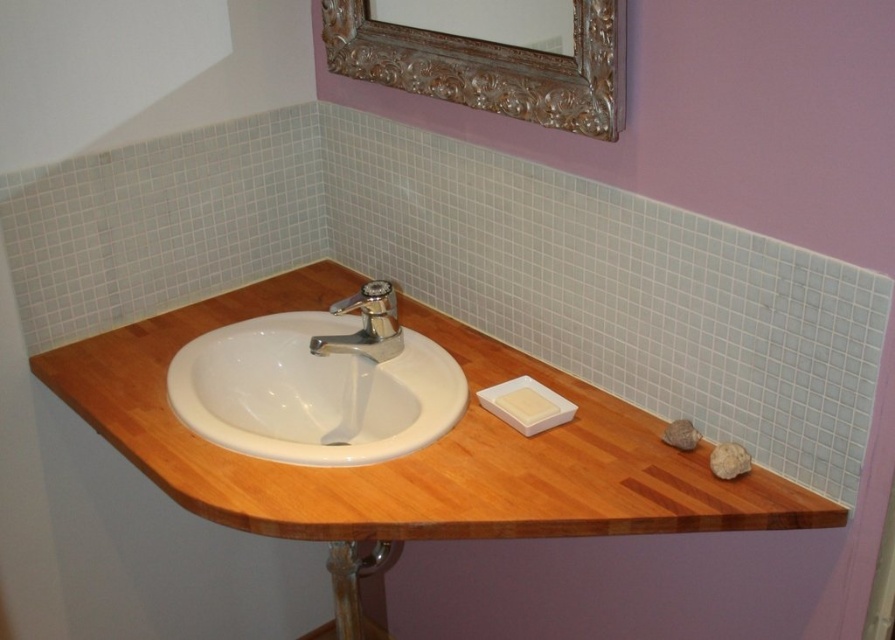
You are standing in front of the bathroom sink and want to reach a point that is 4.09 feet away from your position. Is the point at point (537, 102) within your reach?

The point at point (537, 102) is 4.09 feet from the camera, so if you are standing in front of the bathroom sink, you can reach it if your arm can extend 4.09 feet.

You are standing in the bathroom and want to place a decorative vase on the wooden stool at lower center so it can be seen in the reflection of the gold ornate mirror at upper center. Will the vase be visible in the mirror?

The gold ornate mirror at upper center is to the right of the wooden stool at lower center, so placing the vase on the wooden stool at lower center should allow it to be seen in the mirror as long as the angle and distance between them permit visibility.

You are designing a bathroom layout and need to ensure that the white ceramic sink at center and the gold ornate mirror at upper center are positioned correctly. According to the image, which object is taller?

The gold ornate mirror at upper center is taller than the white ceramic sink at center.